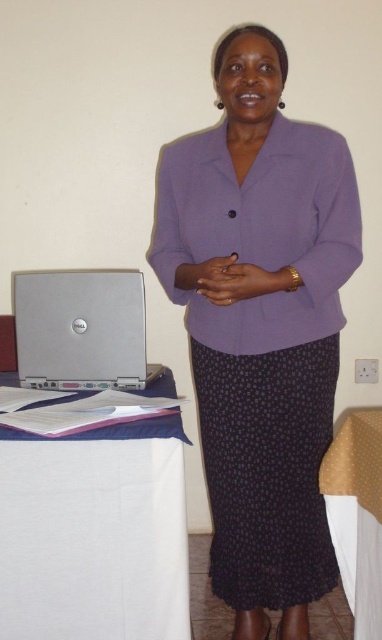
Question: Considering the real-world distances, which object is farthest from the white cloth at lower left?

Choices:
 (A) purple matte blazer at center
 (B) silver metallic laptop at lower left
 (C) dark polka dot skirt at center

Answer: (B)

Question: Based on their relative distances, which object is farther from the white cloth at lower left?

Choices:
 (A) silver metallic laptop at lower left
 (B) gold fabric tablecloth at lower right
 (C) purple matte blazer at center

Answer: (B)

Question: Can you confirm if white cloth at lower left is smaller than silver metallic laptop at lower left?

Choices:
 (A) no
 (B) yes

Answer: (B)

Question: Which object is the farthest from the dark polka dot skirt at center?

Choices:
 (A) silver metallic laptop at lower left
 (B) white cloth at lower left
 (C) gold fabric tablecloth at lower right
 (D) purple matte blazer at center

Answer: (A)

Question: Can you confirm if white cloth at lower left is wider than gold fabric tablecloth at lower right?

Choices:
 (A) yes
 (B) no

Answer: (A)

Question: Is white cloth at lower left smaller than dark polka dot skirt at center?

Choices:
 (A) yes
 (B) no

Answer: (A)